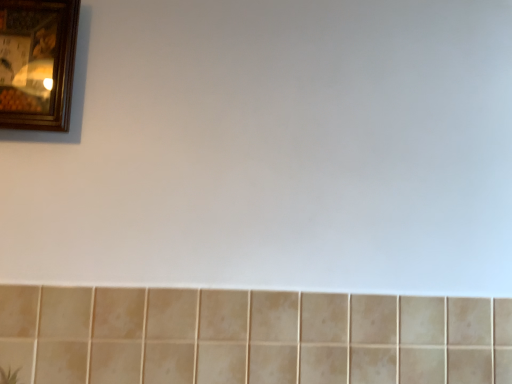
Question: From a real-world perspective, is wooden picture frame at upper left positioned under beige matte tile at lower center based on gravity?

Choices:
 (A) yes
 (B) no

Answer: (B)

Question: Is wooden picture frame at upper left next to beige matte tile at lower center and touching it?

Choices:
 (A) yes
 (B) no

Answer: (B)

Question: Can you confirm if wooden picture frame at upper left is taller than beige matte tile at lower center?

Choices:
 (A) no
 (B) yes

Answer: (B)

Question: Considering the relative sizes of wooden picture frame at upper left and beige matte tile at lower center in the image provided, is wooden picture frame at upper left bigger than beige matte tile at lower center?

Choices:
 (A) yes
 (B) no

Answer: (B)

Question: Does wooden picture frame at upper left lie in front of beige matte tile at lower center?

Choices:
 (A) yes
 (B) no

Answer: (B)

Question: From a real-world perspective, is wooden picture frame at upper left physically above beige matte tile at lower center?

Choices:
 (A) no
 (B) yes

Answer: (B)

Question: Is beige matte tile at lower center closer to the viewer compared to wooden picture frame at upper left?

Choices:
 (A) no
 (B) yes

Answer: (B)

Question: Can you confirm if beige matte tile at lower center is shorter than wooden picture frame at upper left?

Choices:
 (A) yes
 (B) no

Answer: (A)

Question: From the image's perspective, is beige matte tile at lower center located beneath wooden picture frame at upper left?

Choices:
 (A) no
 (B) yes

Answer: (B)

Question: Is beige matte tile at lower center at the right side of wooden picture frame at upper left?

Choices:
 (A) no
 (B) yes

Answer: (B)

Question: From a real-world perspective, is beige matte tile at lower center on wooden picture frame at upper left?

Choices:
 (A) yes
 (B) no

Answer: (B)

Question: Is beige matte tile at lower center with wooden picture frame at upper left?

Choices:
 (A) yes
 (B) no

Answer: (B)

Question: Considering the positions of beige matte tile at lower center and wooden picture frame at upper left in the image, is beige matte tile at lower center wider or thinner than wooden picture frame at upper left?

Choices:
 (A) wide
 (B) thin

Answer: (B)